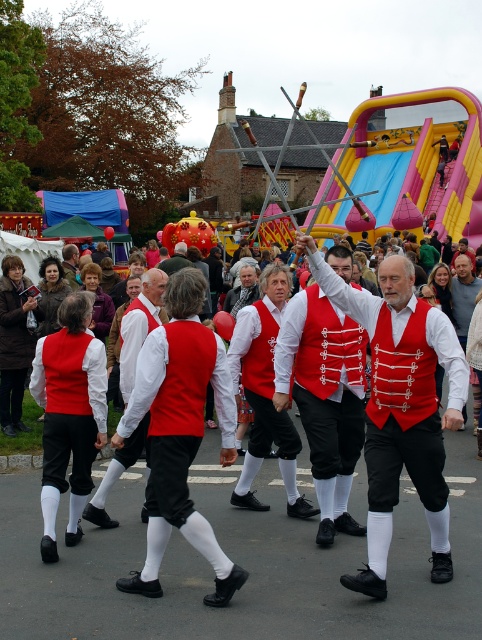
You are a costume designer preparing for a performance. You have two vests available for the lead dancer at the center of the stage. The first is a matte red vest at center, and the second is a red velvet vest at center. Which vest should you choose if you want the one that is shorter?

The matte red vest at center is shorter than the red velvet vest at center, so you should choose the matte red vest at center.